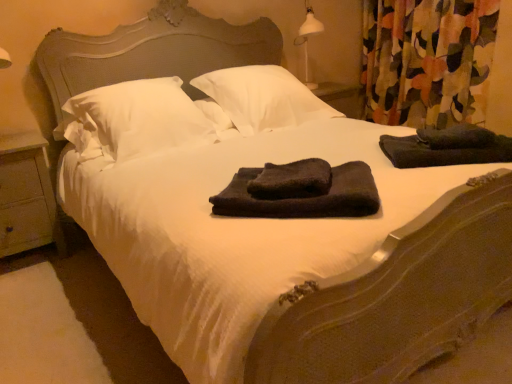
Question: Can you confirm if white soft pillow at center, which appears as the first pillow when viewed from the right, is taller than wooden at left?

Choices:
 (A) no
 (B) yes

Answer: (A)

Question: Is white soft pillow at center, the 2th pillow from the left, closer to camera compared to wooden at left?

Choices:
 (A) yes
 (B) no

Answer: (B)

Question: Is the position of white soft pillow at center, which appears as the first pillow when viewed from the right, more distant than that of wooden at left?

Choices:
 (A) yes
 (B) no

Answer: (A)

Question: Is white soft pillow at center, which appears as the first pillow when viewed from the right, outside wooden at left?

Choices:
 (A) no
 (B) yes

Answer: (B)

Question: Is white soft pillow at center, the 2th pillow from the left, at the right side of wooden at left?

Choices:
 (A) yes
 (B) no

Answer: (A)

Question: In the image, is floral fabric curtain at upper right positioned in front of or behind wooden at left?

Choices:
 (A) front
 (B) behind

Answer: (B)

Question: Is floral fabric curtain at upper right inside the boundaries of wooden at left, or outside?

Choices:
 (A) outside
 (B) inside

Answer: (A)

Question: Visually, is floral fabric curtain at upper right positioned to the left or to the right of wooden at left?

Choices:
 (A) right
 (B) left

Answer: (A)

Question: From the image's perspective, relative to wooden at left, is floral fabric curtain at upper right above or below?

Choices:
 (A) below
 (B) above

Answer: (B)

Question: Relative to dark gray plush bath towel at center, the second bath towel when ordered from right to left, is white soft pillow at center, the 2th pillow from the right, in front or behind?

Choices:
 (A) front
 (B) behind

Answer: (B)

Question: From a real-world perspective, is white soft pillow at center, the 2th pillow from the right, physically located above or below dark gray plush bath towel at center, marked as the 1th bath towel in a left-to-right arrangement?

Choices:
 (A) above
 (B) below

Answer: (A)

Question: Is white soft pillow at center, which is the first pillow from left to right, taller or shorter than dark gray plush bath towel at center, marked as the 1th bath towel in a left-to-right arrangement?

Choices:
 (A) tall
 (B) short

Answer: (A)

Question: Is white soft pillow at center, which is the first pillow from left to right, situated inside dark gray plush bath towel at center, the second bath towel when ordered from right to left, or outside?

Choices:
 (A) outside
 (B) inside

Answer: (A)

Question: In the image, is dark gray plush bath towel at center, placed as the second bath towel when sorted from left to right, positioned in front of or behind dark gray plush bath towel at center, the second bath towel when ordered from right to left?

Choices:
 (A) front
 (B) behind

Answer: (A)

Question: In terms of width, does dark gray plush bath towel at center, arranged as the first bath towel when viewed from the right, look wider or thinner when compared to dark gray plush bath towel at center, marked as the 1th bath towel in a left-to-right arrangement?

Choices:
 (A) thin
 (B) wide

Answer: (B)